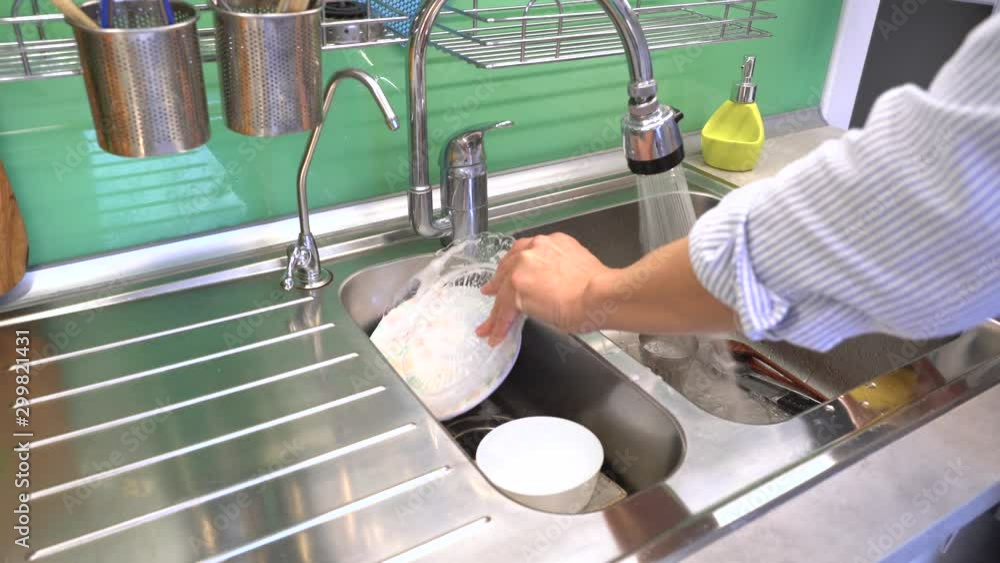
I want to click on dishes, so click(x=563, y=491).